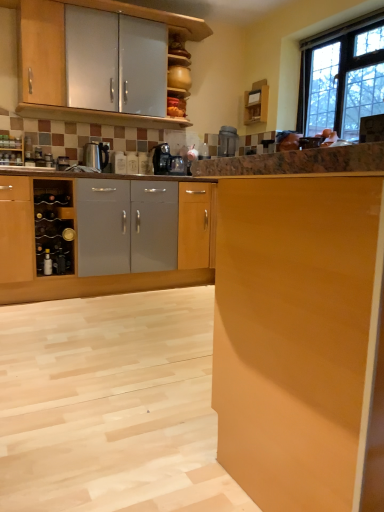
Question: Is metallic silver wine rack at left, arranged as the 1th appliance when viewed from the front, surrounded by wooden wine rack at left?

Choices:
 (A) yes
 (B) no

Answer: (B)

Question: Does wooden wine rack at left have a smaller size compared to metallic silver wine rack at left, the 2th appliance when ordered from top to bottom?

Choices:
 (A) no
 (B) yes

Answer: (A)

Question: Does wooden wine rack at left appear on the left side of metallic silver wine rack at left, the 2th appliance viewed from the right?

Choices:
 (A) yes
 (B) no

Answer: (A)

Question: Considering the relative sizes of wooden wine rack at left and metallic silver wine rack at left, the 2th appliance when ordered from top to bottom, in the image provided, is wooden wine rack at left bigger than metallic silver wine rack at left, the 2th appliance when ordered from top to bottom,?

Choices:
 (A) yes
 (B) no

Answer: (A)

Question: From a real-world perspective, is wooden wine rack at left on metallic silver wine rack at left, the second appliance viewed from the back?

Choices:
 (A) no
 (B) yes

Answer: (B)

Question: Is point (8, 158) closer or farther from the camera than point (264, 103)?

Choices:
 (A) closer
 (B) farther

Answer: (A)

Question: From their relative heights in the image, would you say wooden wine rack at left is taller or shorter than wooden cabinet at upper center, the first cabinetry positioned from the back?

Choices:
 (A) tall
 (B) short

Answer: (B)

Question: Is wooden wine rack at left to the left or to the right of wooden cabinet at upper center, the first cabinetry positioned from the back, in the image?

Choices:
 (A) right
 (B) left

Answer: (B)

Question: From the image's perspective, is wooden wine rack at left above or below wooden cabinet at upper center, the first cabinetry positioned from the back?

Choices:
 (A) below
 (B) above

Answer: (A)

Question: From a real-world perspective, is matte wood cabinet at right, which is counted as the 1th cabinetry, starting from the front, positioned above or below clear glass window at upper right?

Choices:
 (A) above
 (B) below

Answer: (B)

Question: From their relative heights in the image, would you say matte wood cabinet at right, marked as the second cabinetry in a top-to-bottom arrangement, is taller or shorter than clear glass window at upper right?

Choices:
 (A) short
 (B) tall

Answer: (B)

Question: Is matte wood cabinet at right, marked as the second cabinetry in a top-to-bottom arrangement, bigger or smaller than clear glass window at upper right?

Choices:
 (A) small
 (B) big

Answer: (B)

Question: From the image's perspective, relative to clear glass window at upper right, is matte wood cabinet at right, marked as the second cabinetry in a top-to-bottom arrangement, above or below?

Choices:
 (A) above
 (B) below

Answer: (B)

Question: Is metallic silver toaster at upper center, the second appliance when ordered from left to right, in front of or behind metallic silver wine rack at left, the 2th appliance when ordered from top to bottom, in the image?

Choices:
 (A) behind
 (B) front

Answer: (A)

Question: Considering the positions of metallic silver toaster at upper center, which is the second appliance in front-to-back order, and metallic silver wine rack at left, the second appliance viewed from the back, in the image, is metallic silver toaster at upper center, which is the second appliance in front-to-back order, taller or shorter than metallic silver wine rack at left, the second appliance viewed from the back,?

Choices:
 (A) tall
 (B) short

Answer: (A)